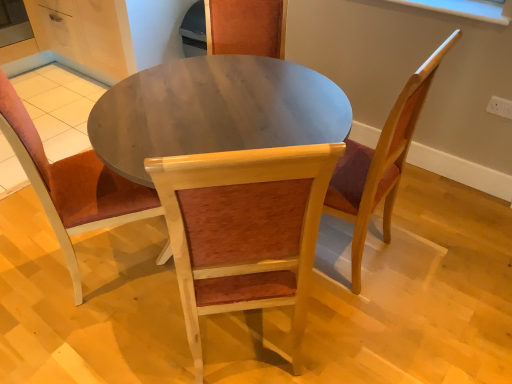
Where is `vacant area located to the right-hand side of wooden chair at center, the 2th chair in the right-to-left sequence`? The image size is (512, 384). vacant area located to the right-hand side of wooden chair at center, the 2th chair in the right-to-left sequence is located at coordinates point(358,331).